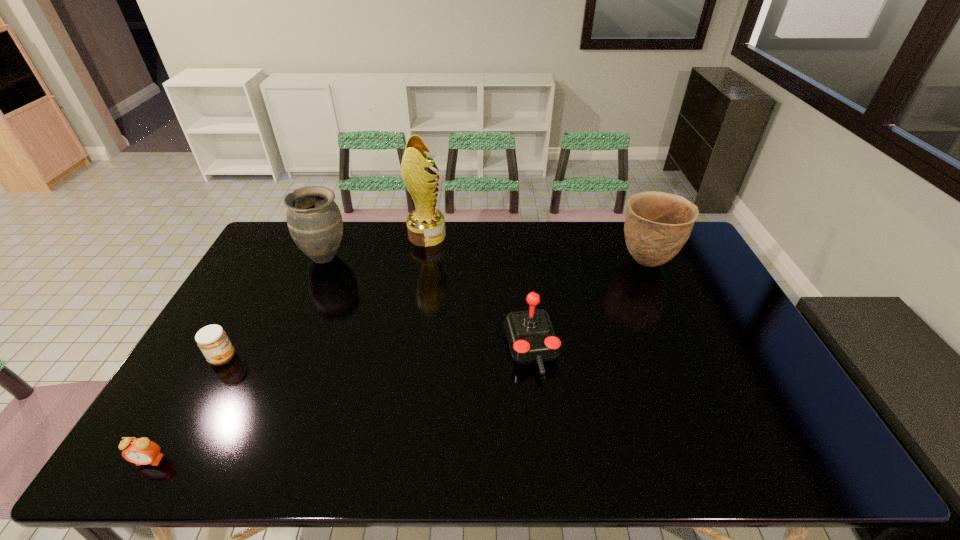
In order to click on the fourth object from left to right in this screenshot , I will do `click(426, 225)`.

Identify the location of award. This screenshot has width=960, height=540. (426, 225).

The width and height of the screenshot is (960, 540). In order to click on urn in this screenshot , I will do `click(314, 220)`.

I want to click on pottery, so click(657, 225).

Identify the location of joystick. Image resolution: width=960 pixels, height=540 pixels. (531, 337).

Image resolution: width=960 pixels, height=540 pixels. What are the coordinates of `the fourth tallest object` in the screenshot? It's located at (531, 337).

Locate an element on the screen. This screenshot has height=540, width=960. jam is located at coordinates (212, 340).

Identify the location of the nearest object. This screenshot has width=960, height=540. (141, 451).

The image size is (960, 540). Find the location of `vacant space located 0.150m on the front-facing side of the third object from right to left`. vacant space located 0.150m on the front-facing side of the third object from right to left is located at coordinates (486, 236).

Locate an element on the screen. vacant space located 0.390m on the front of the fourth object from right to left is located at coordinates (279, 364).